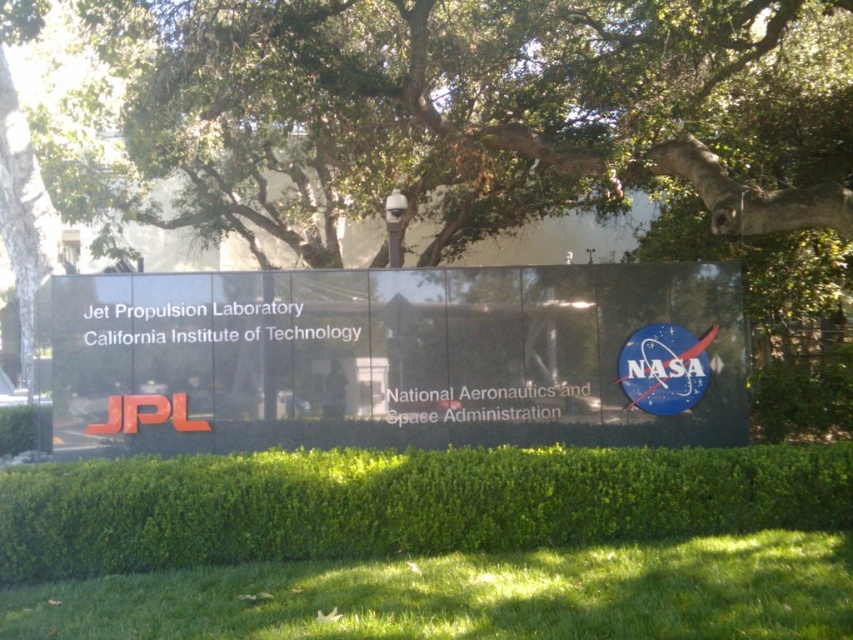
Question: Is green leafy hedge at center positioned in front of green grass at lower center?

Choices:
 (A) no
 (B) yes

Answer: (A)

Question: Is green leafy tree at upper center bigger than green leafy hedge at center?

Choices:
 (A) yes
 (B) no

Answer: (A)

Question: In this image, where is green leafy tree at upper center located relative to green leafy hedge at center?

Choices:
 (A) right
 (B) left

Answer: (B)

Question: Which object is positioned farthest from the green grass at lower center?

Choices:
 (A) green leafy tree at upper center
 (B) green leafy hedge at center

Answer: (A)

Question: Estimate the real-world distances between objects in this image. Which object is closer to the green grass at lower center?

Choices:
 (A) green leafy tree at upper center
 (B) green leafy hedge at center

Answer: (B)

Question: Among these points, which one is nearest to the camera?

Choices:
 (A) (111, 602)
 (B) (238, 461)

Answer: (A)